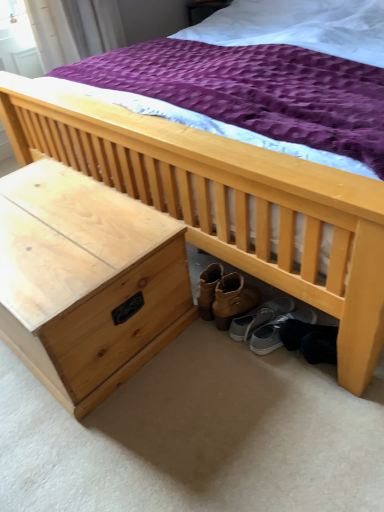
This screenshot has height=512, width=384. Find the location of `gray suede sneakers at lower right, the 1th footwear positioned from the right`. gray suede sneakers at lower right, the 1th footwear positioned from the right is located at coordinates (277, 331).

How many degrees apart are the facing directions of natural wood nightstand at lower left and gray fabric shoe at under bed, the second footwear when ordered from right to left?

natural wood nightstand at lower left and gray fabric shoe at under bed, the second footwear when ordered from right to left, are facing 166 degrees away from each other.

Which is in front, point (119, 217) or point (269, 307)?

The point (119, 217) is closer to the camera.

Is natural wood nightstand at lower left aimed at gray fabric shoe at under bed, the first footwear viewed from the left?

No, natural wood nightstand at lower left is not turned towards gray fabric shoe at under bed, the first footwear viewed from the left.

Considering the relative sizes of natural wood nightstand at lower left and gray fabric shoe at under bed, the first footwear viewed from the left, in the image provided, is natural wood nightstand at lower left wider than gray fabric shoe at under bed, the first footwear viewed from the left,?

Correct, the width of natural wood nightstand at lower left exceeds that of gray fabric shoe at under bed, the first footwear viewed from the left.

Which of these two, gray fabric shoe at under bed, the first footwear viewed from the left, or natural wood nightstand at lower left, is smaller?

gray fabric shoe at under bed, the first footwear viewed from the left, is smaller.

Who is taller, gray fabric shoe at under bed, the second footwear when ordered from right to left, or natural wood nightstand at lower left?

natural wood nightstand at lower left is taller.

Which is in front, point (280, 309) or point (146, 210)?

Point (146, 210)

Is gray fabric shoe at under bed, the second footwear when ordered from right to left, closer to camera compared to natural wood nightstand at lower left?

No, gray fabric shoe at under bed, the second footwear when ordered from right to left, is further to the viewer.

From a real-world perspective, between gray suede sneakers at lower right, acting as the 2th footwear starting from the left, and gray fabric shoe at under bed, the second footwear when ordered from right to left, who is vertically lower?

In real-world perspective, gray suede sneakers at lower right, acting as the 2th footwear starting from the left, is lower.

Is gray suede sneakers at lower right, the 1th footwear positioned from the right, looking in the opposite direction of gray fabric shoe at under bed, the first footwear viewed from the left?

No.

Is gray suede sneakers at lower right, acting as the 2th footwear starting from the left, bigger than gray fabric shoe at under bed, the second footwear when ordered from right to left?

Yes, gray suede sneakers at lower right, acting as the 2th footwear starting from the left, is bigger than gray fabric shoe at under bed, the second footwear when ordered from right to left.

How many degrees apart are the facing directions of gray suede sneakers at lower right, the 1th footwear positioned from the right, and gray fabric shoe at under bed, the first footwear viewed from the left?

The facing directions of gray suede sneakers at lower right, the 1th footwear positioned from the right, and gray fabric shoe at under bed, the first footwear viewed from the left, are 0.000121 degrees apart.

From a real-world perspective, is natural wood nightstand at lower left over gray suede sneakers at lower right, acting as the 2th footwear starting from the left?

Correct, in the physical world, natural wood nightstand at lower left is higher than gray suede sneakers at lower right, acting as the 2th footwear starting from the left.

Which is more distant, (67,330) or (265,347)?

The point (265,347) is farther from the camera.

Is natural wood nightstand at lower left facing away from gray suede sneakers at lower right, acting as the 2th footwear starting from the left?

That's not correct — natural wood nightstand at lower left is not looking away from gray suede sneakers at lower right, acting as the 2th footwear starting from the left.

Looking at this image, how many degrees apart are the facing directions of natural wood nightstand at lower left and gray suede sneakers at lower right, acting as the 2th footwear starting from the left?

166 degrees separate the facing orientations of natural wood nightstand at lower left and gray suede sneakers at lower right, acting as the 2th footwear starting from the left.

Is gray fabric shoe at under bed, the second footwear when ordered from right to left, at the left side of gray suede sneakers at lower right, the 1th footwear positioned from the right?

Yes.

Which point is more distant from viewer, (269, 303) or (290, 316)?

The point (269, 303) is farther from the camera.

Is gray suede sneakers at lower right, the 1th footwear positioned from the right, outside of natural wood nightstand at lower left?

Yes, gray suede sneakers at lower right, the 1th footwear positioned from the right, is outside of natural wood nightstand at lower left.

Which is less distant, (276, 329) or (31, 220)?

The point (276, 329) is in front.

From a real-world perspective, is gray suede sneakers at lower right, the 1th footwear positioned from the right, beneath natural wood nightstand at lower left?

Indeed, from a real-world perspective, gray suede sneakers at lower right, the 1th footwear positioned from the right, is positioned beneath natural wood nightstand at lower left.

Is gray suede sneakers at lower right, the 1th footwear positioned from the right, next to natural wood nightstand at lower left?

→ gray suede sneakers at lower right, the 1th footwear positioned from the right, and natural wood nightstand at lower left are clearly separated.

This screenshot has height=512, width=384. What are the coordinates of `footwear that is the 1st one when counting downward from the natural wood nightstand at lower left (from the image's perspective)` in the screenshot? It's located at (259, 317).

You are a GUI agent. You are given a task and a screenshot of the screen. Output one action in this format:
    pyautogui.click(x=<x>, y=<y>)
    Task: Click on the 1st footwear to the right of the natural wood nightstand at lower left, starting your count from the anchor
    This screenshot has height=512, width=384.
    Given the screenshot: What is the action you would take?
    pyautogui.click(x=259, y=317)

Looking at the image, which one is located closer to gray fabric shoe at under bed, the first footwear viewed from the left, gray suede sneakers at lower right, the 1th footwear positioned from the right, or natural wood nightstand at lower left?

The object closer to gray fabric shoe at under bed, the first footwear viewed from the left, is gray suede sneakers at lower right, the 1th footwear positioned from the right.

Which object lies further to the anchor point natural wood nightstand at lower left, gray fabric shoe at under bed, the first footwear viewed from the left, or gray suede sneakers at lower right, the 1th footwear positioned from the right?

Among the two, gray suede sneakers at lower right, the 1th footwear positioned from the right, is located further to natural wood nightstand at lower left.

Based on the photo, from the image, which object appears to be nearer to gray fabric shoe at under bed, the first footwear viewed from the left, natural wood nightstand at lower left or gray suede sneakers at lower right, the 1th footwear positioned from the right?

gray suede sneakers at lower right, the 1th footwear positioned from the right.

When comparing their distances from natural wood nightstand at lower left, does gray suede sneakers at lower right, acting as the 2th footwear starting from the left, or gray fabric shoe at under bed, the first footwear viewed from the left, seem closer?

The object closer to natural wood nightstand at lower left is gray fabric shoe at under bed, the first footwear viewed from the left.

Based on their spatial positions, is gray fabric shoe at under bed, the first footwear viewed from the left, or natural wood nightstand at lower left further from gray suede sneakers at lower right, acting as the 2th footwear starting from the left?

Based on the image, natural wood nightstand at lower left appears to be further to gray suede sneakers at lower right, acting as the 2th footwear starting from the left.

Estimate the real-world distances between objects in this image. Which object is closer to gray suede sneakers at lower right, the 1th footwear positioned from the right, natural wood nightstand at lower left or gray fabric shoe at under bed, the second footwear when ordered from right to left?

gray fabric shoe at under bed, the second footwear when ordered from right to left, is positioned closer to the anchor gray suede sneakers at lower right, the 1th footwear positioned from the right.

Locate an element on the screen. The image size is (384, 512). footwear between natural wood nightstand at lower left and gray suede sneakers at lower right, the 1th footwear positioned from the right, from left to right is located at coordinates (259, 317).